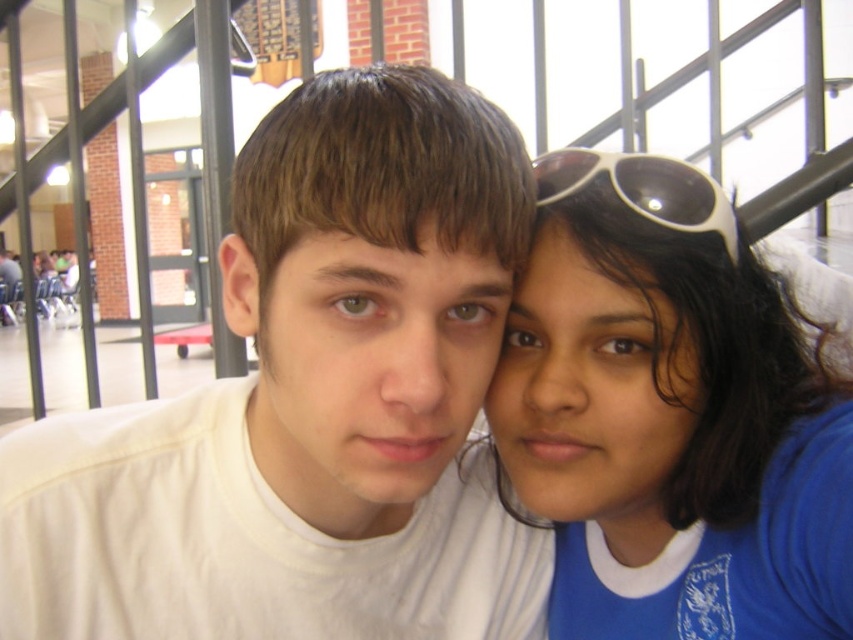
Question: Does white matte t-shirt at center have a lesser width compared to white plastic sunglasses at upper right?

Choices:
 (A) no
 (B) yes

Answer: (A)

Question: Which point is closer to the camera?

Choices:
 (A) white plastic sunglasses at upper right
 (B) blue fabric shirt at right
 (C) white matte t-shirt at center

Answer: (C)

Question: Which point appears closest to the camera in this image?

Choices:
 (A) (318, 602)
 (B) (720, 230)
 (C) (601, 317)

Answer: (C)

Question: Is white matte t-shirt at center thinner than blue fabric shirt at right?

Choices:
 (A) no
 (B) yes

Answer: (A)

Question: Is blue fabric shirt at right further to the viewer compared to white plastic sunglasses at upper right?

Choices:
 (A) yes
 (B) no

Answer: (B)

Question: Which object is the closest to the blue fabric shirt at right?

Choices:
 (A) white matte t-shirt at center
 (B) white plastic sunglasses at upper right

Answer: (B)